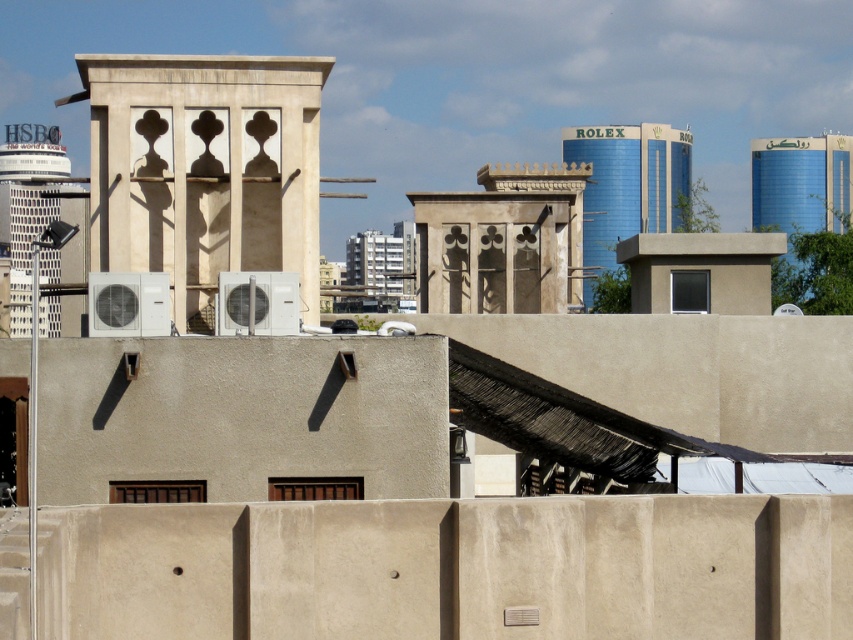
Question: Is blue metallic tower at upper right bigger than white concrete tower at left?

Choices:
 (A) yes
 (B) no

Answer: (B)

Question: Is beige concrete tower at center to the left of blue glass tower at upper right from the viewer's perspective?

Choices:
 (A) yes
 (B) no

Answer: (A)

Question: Which point appears closest to the camera in this image?

Choices:
 (A) (640, 136)
 (B) (283, 168)
 (C) (12, 196)

Answer: (B)

Question: Which of these objects is positioned closest to the blue metallic tower at upper right?

Choices:
 (A) white concrete tower at left
 (B) beige concrete tower at center

Answer: (A)

Question: Estimate the real-world distances between objects in this image. Which object is closer to the blue metallic tower at upper right?

Choices:
 (A) beige concrete tower at center
 (B) white concrete tower at left

Answer: (B)

Question: Does beige concrete tower at center appear on the left side of blue glass tower at upper right?

Choices:
 (A) no
 (B) yes

Answer: (B)